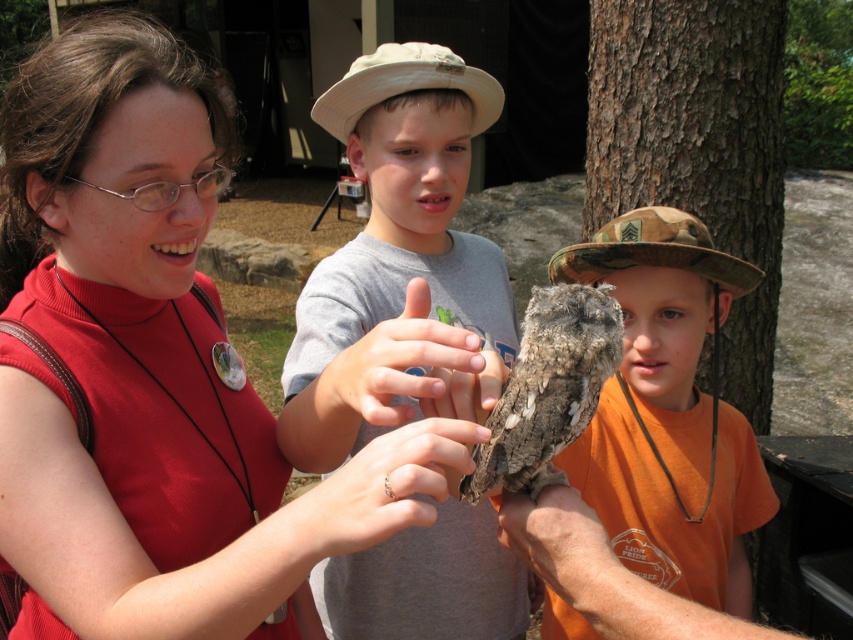
From the picture: Does camouflage hat at center appear under smooth orange skin at lower center?

No, camouflage hat at center is not below smooth orange skin at lower center.

At what (x,y) coordinates should I click in order to perform the action: click on camouflage hat at center. Please return your answer as a coordinate pair (x, y). The width and height of the screenshot is (853, 640). Looking at the image, I should click on (668, 412).

Measure the distance between camouflage hat at center and camera.

They are 4.74 feet apart.

Locate an element on the screen. camouflage hat at center is located at coordinates (668, 412).

Can you confirm if gray cotton shirt at center is thinner than camouflage hat at center?

Correct, gray cotton shirt at center's width is less than camouflage hat at center's.

Is point (437, 228) in front of point (718, 417)?

Yes.

Who is more forward, (425, 115) or (653, 433)?

Positioned in front is point (425, 115).

Locate an element on the screen. The width and height of the screenshot is (853, 640). gray cotton shirt at center is located at coordinates (393, 253).

Who is more distant from viewer, [431,225] or [407,387]?

The point [431,225] is behind.

Does gray cotton shirt at center have a smaller size compared to smooth skin hand at center?

No, gray cotton shirt at center is not smaller than smooth skin hand at center.

This screenshot has height=640, width=853. What do you see at coordinates (393, 253) in the screenshot?
I see `gray cotton shirt at center` at bounding box center [393, 253].

The height and width of the screenshot is (640, 853). Identify the location of gray cotton shirt at center. (393, 253).